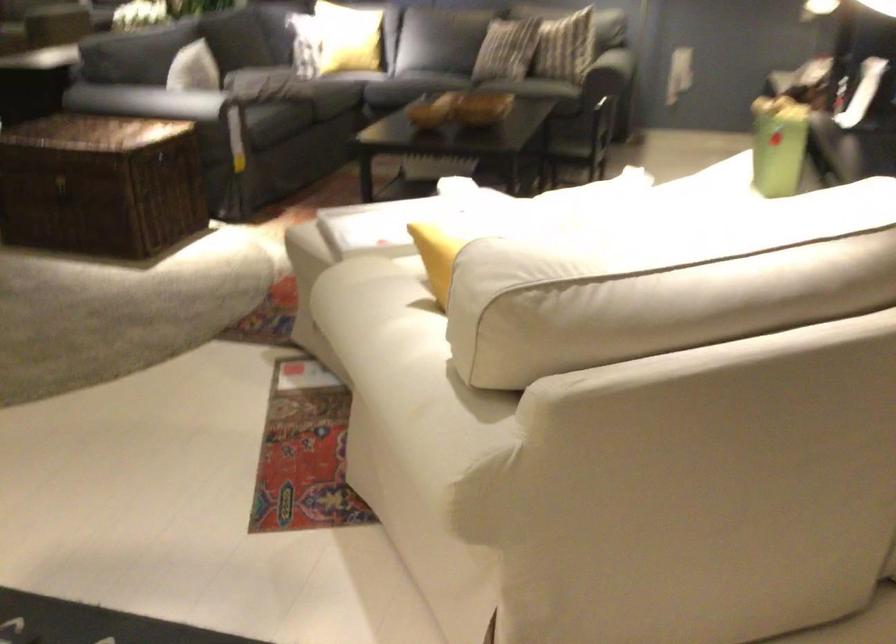
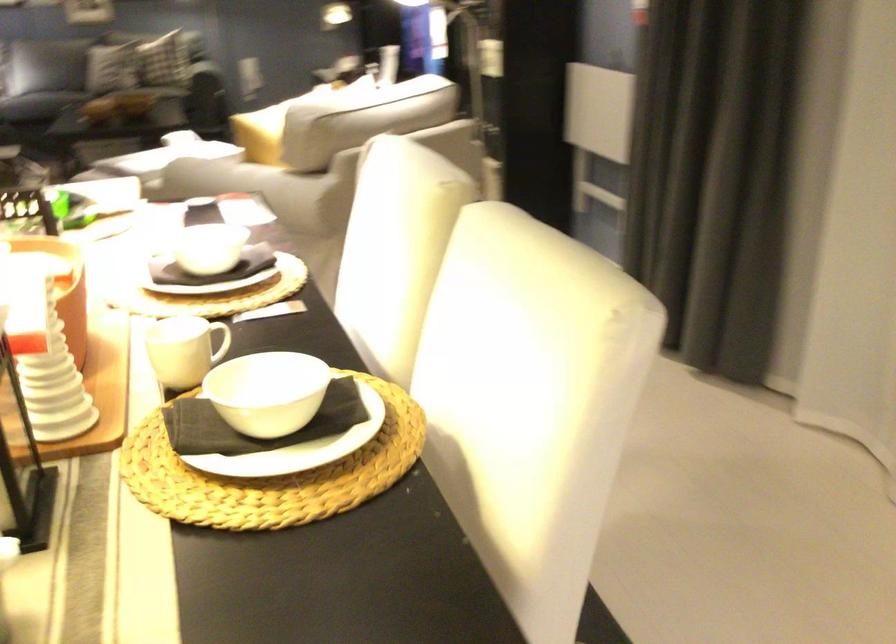
The point at (390, 384) is marked in the first image. Where is the corresponding point in the second image?

(264, 185)